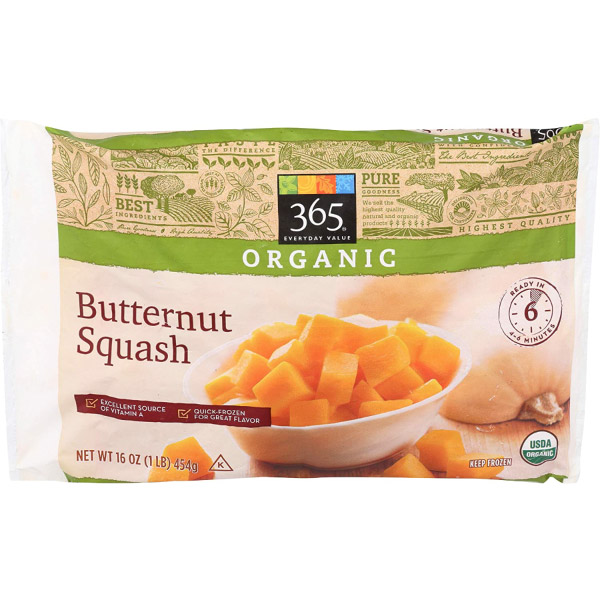
Image resolution: width=600 pixels, height=600 pixels. I want to click on table, so click(x=502, y=437).